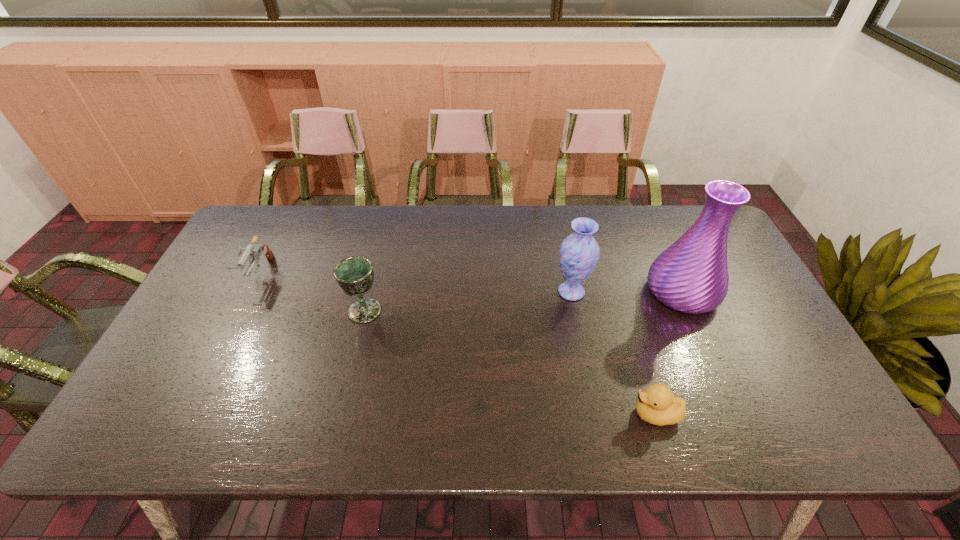
Image resolution: width=960 pixels, height=540 pixels. Find the location of `free space that is in between the left vase and the right vase`. free space that is in between the left vase and the right vase is located at coordinates (627, 292).

You are a GUI agent. You are given a task and a screenshot of the screen. Output one action in this format:
    pyautogui.click(x=<x>, y=<y>)
    Task: Click on the free space between the gun and the rightmost object
    The height and width of the screenshot is (540, 960).
    Given the screenshot: What is the action you would take?
    pyautogui.click(x=470, y=282)

The height and width of the screenshot is (540, 960). Find the location of `free spot between the gun and the second object from left to right`. free spot between the gun and the second object from left to right is located at coordinates (312, 292).

At what (x,y) coordinates should I click in order to perform the action: click on object that is the closest to the leftmost object. Please return your answer as a coordinate pair (x, y). Looking at the image, I should click on (354, 275).

The height and width of the screenshot is (540, 960). Identify the location of the second closest object relative to the gun. (579, 252).

You are a GUI agent. You are given a task and a screenshot of the screen. Output one action in this format:
    pyautogui.click(x=<x>, y=<y>)
    Task: Click on the free space in the image that satisfies the following two spatial constraints: 1. at the barrel end of the gun; 2. on the right side of the fourth object from right to left
    
    Given the screenshot: What is the action you would take?
    pyautogui.click(x=240, y=310)

Locate an element on the screen. free space in the image that satisfies the following two spatial constraints: 1. at the barrel end of the third object from left to right; 2. on the left side of the gun is located at coordinates (250, 292).

I want to click on vacant region that satisfies the following two spatial constraints: 1. at the barrel end of the leftmost object; 2. on the left side of the third tallest object, so click(x=240, y=310).

You are a GUI agent. You are given a task and a screenshot of the screen. Output one action in this format:
    pyautogui.click(x=<x>, y=<y>)
    Task: Click on the free space in the image that satisfies the following two spatial constraints: 1. at the barrel end of the chalice; 2. on the left side of the leftmost object
    The height and width of the screenshot is (540, 960).
    Given the screenshot: What is the action you would take?
    pyautogui.click(x=240, y=310)